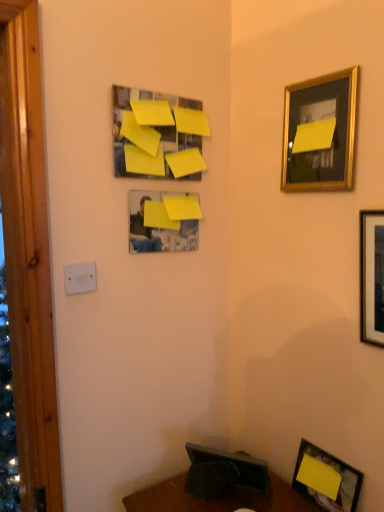
This screenshot has width=384, height=512. Find the location of `white plastic/light switch at lower left`. white plastic/light switch at lower left is located at coordinates (80, 278).

Image resolution: width=384 pixels, height=512 pixels. What do you see at coordinates (320, 133) in the screenshot? I see `gold metallic picture frame at upper right, which is counted as the third picture frame, starting from the left` at bounding box center [320, 133].

This screenshot has width=384, height=512. What do you see at coordinates (157, 135) in the screenshot? I see `yellow paper at upper center, positioned as the first picture frame in top-to-bottom order` at bounding box center [157, 135].

At what (x,y) coordinates should I click in order to perform the action: click on white plastic/light switch at lower left. Please return your answer as a coordinate pair (x, y). The height and width of the screenshot is (512, 384). Looking at the image, I should click on (80, 278).

Is yellow paper at upper center, which is the 5th picture frame from right to left, at the right side of wooden framed picture at right, arranged as the fourth picture frame when viewed from the top?

No.

Does point (130, 147) come in front of point (377, 327)?

That is False.

Is yellow paper at upper center, which ranks as the fifth picture frame in bottom-to-top order, aimed at wooden framed picture at right, arranged as the fourth picture frame when viewed from the top?

No, yellow paper at upper center, which ranks as the fifth picture frame in bottom-to-top order, is not aimed at wooden framed picture at right, arranged as the fourth picture frame when viewed from the top.

Is yellow paper at upper center, the 1th picture frame viewed from the left, next to wooden framed picture at right, which is the 1th picture frame in right-to-left order?

No.

From a real-world perspective, is gold metallic picture frame at upper right, arranged as the third picture frame when viewed from the right, positioned above or below white plastic/light switch at lower left?

Clearly, from a real-world perspective, gold metallic picture frame at upper right, arranged as the third picture frame when viewed from the right, is above white plastic/light switch at lower left.

Can we say gold metallic picture frame at upper right, which is counted as the third picture frame, starting from the left, lies outside white plastic/light switch at lower left?

Yes, gold metallic picture frame at upper right, which is counted as the third picture frame, starting from the left, is located beyond the bounds of white plastic/light switch at lower left.

Between gold metallic picture frame at upper right, the 4th picture frame from the bottom, and white plastic/light switch at lower left, which one appears on the right side from the viewer's perspective?

Positioned to the right is gold metallic picture frame at upper right, the 4th picture frame from the bottom.

Who is shorter, gold metallic picture frame at upper right, which is counted as the third picture frame, starting from the left, or white plastic/light switch at lower left?

white plastic/light switch at lower left is shorter.

Image resolution: width=384 pixels, height=512 pixels. In order to click on the 1st picture frame below the yellow matte picture frame at upper center, which is the 4th picture frame from right to left (from the image's perspective) in this screenshot , I will do `click(372, 277)`.

Is yellow matte picture frame at upper center, which is the 4th picture frame from right to left, far away from wooden framed picture at right, which is the 1th picture frame in right-to-left order?

yellow matte picture frame at upper center, which is the 4th picture frame from right to left, is near wooden framed picture at right, which is the 1th picture frame in right-to-left order, not far away.

Is yellow matte picture frame at upper center, which ranks as the 3th picture frame in bottom-to-top order, turned away from wooden framed picture at right, which is the 1th picture frame in right-to-left order?

yellow matte picture frame at upper center, which ranks as the 3th picture frame in bottom-to-top order, is not turned away from wooden framed picture at right, which is the 1th picture frame in right-to-left order.

Is yellow matte paper at lower right, which is the 1th picture frame from bottom to top, positioned behind gold metallic picture frame at upper right, which is counted as the third picture frame, starting from the left?

Yes, yellow matte paper at lower right, which is the 1th picture frame from bottom to top, is further from the camera.

Does yellow matte paper at lower right, the 2th picture frame when ordered from right to left, turn towards gold metallic picture frame at upper right, positioned as the 2th picture frame in top-to-bottom order?

No, yellow matte paper at lower right, the 2th picture frame when ordered from right to left, does not turn towards gold metallic picture frame at upper right, positioned as the 2th picture frame in top-to-bottom order.

From a real-world perspective, relative to gold metallic picture frame at upper right, the 4th picture frame from the bottom, is yellow matte paper at lower right, the 4th picture frame viewed from the left, vertically above or below?

From a real-world perspective, yellow matte paper at lower right, the 4th picture frame viewed from the left, is physically below gold metallic picture frame at upper right, the 4th picture frame from the bottom.

Is yellow matte paper at lower right, the 2th picture frame when ordered from right to left, not close to gold metallic picture frame at upper right, which is counted as the third picture frame, starting from the left?

No, yellow matte paper at lower right, the 2th picture frame when ordered from right to left, is not far from gold metallic picture frame at upper right, which is counted as the third picture frame, starting from the left.

Considering the relative sizes of white plastic/light switch at lower left and yellow matte paper at lower right, the 4th picture frame viewed from the left, in the image provided, is white plastic/light switch at lower left smaller than yellow matte paper at lower right, the 4th picture frame viewed from the left,?

Correct, white plastic/light switch at lower left occupies less space than yellow matte paper at lower right, the 4th picture frame viewed from the left.

Is yellow matte paper at lower right, the fifth picture frame viewed from the top, completely or partially inside white plastic/light switch at lower left?

No, yellow matte paper at lower right, the fifth picture frame viewed from the top, is not a part of white plastic/light switch at lower left.

Is white plastic/light switch at lower left to the left or to the right of yellow matte paper at lower right, the fifth picture frame viewed from the top, in the image?

white plastic/light switch at lower left is to the left of yellow matte paper at lower right, the fifth picture frame viewed from the top.

From the picture: What's the angular difference between white plastic/light switch at lower left and yellow matte paper at lower right, the 2th picture frame when ordered from right to left,'s facing directions?

86.8 degrees separate the facing orientations of white plastic/light switch at lower left and yellow matte paper at lower right, the 2th picture frame when ordered from right to left.

From a real-world perspective, is wooden framed picture at right, arranged as the fourth picture frame when viewed from the top, physically below gold metallic picture frame at upper right, which is counted as the third picture frame, starting from the left?

Yes.

Is point (379, 269) behind point (344, 95)?

That is False.

Which of these two, wooden framed picture at right, which appears as the 2th picture frame when ordered from the bottom, or gold metallic picture frame at upper right, arranged as the third picture frame when viewed from the right, is wider?

Wider between the two is gold metallic picture frame at upper right, arranged as the third picture frame when viewed from the right.

Where is `the 2nd picture frame to the right of the gold metallic picture frame at upper right, positioned as the 2th picture frame in top-to-bottom order, starting your count from the anchor`? the 2nd picture frame to the right of the gold metallic picture frame at upper right, positioned as the 2th picture frame in top-to-bottom order, starting your count from the anchor is located at coordinates (372, 277).

At what (x,y) coordinates should I click in order to perform the action: click on the 1st picture frame directly above the yellow matte paper at lower right, the fifth picture frame viewed from the top (from a real-world perspective). Please return your answer as a coordinate pair (x, y). Image resolution: width=384 pixels, height=512 pixels. Looking at the image, I should click on (372, 277).

Is the surface of yellow matte paper at lower right, the fifth picture frame viewed from the top, in direct contact with wooden framed picture at right, which appears as the 2th picture frame when ordered from the bottom?

No, yellow matte paper at lower right, the fifth picture frame viewed from the top, is not with wooden framed picture at right, which appears as the 2th picture frame when ordered from the bottom.

Considering the relative sizes of yellow matte paper at lower right, the 2th picture frame when ordered from right to left, and wooden framed picture at right, which is the 1th picture frame in right-to-left order, in the image provided, is yellow matte paper at lower right, the 2th picture frame when ordered from right to left, smaller than wooden framed picture at right, which is the 1th picture frame in right-to-left order,?

Yes.

From a real-world perspective, count 3rd picture frames downward from the yellow paper at upper center, which ranks as the fifth picture frame in bottom-to-top order, and point to it. Please provide its 2D coordinates.

[(372, 277)]

Which picture frame is the 2nd one when counting from the front of the white plastic/light switch at lower left? Please provide its 2D coordinates.

[(320, 133)]

Considering their positions, is gold metallic picture frame at upper right, arranged as the third picture frame when viewed from the right, positioned closer to yellow matte picture frame at upper center, which is the 4th picture frame from right to left, than white plastic/light switch at lower left?

Among the two, white plastic/light switch at lower left is located nearer to yellow matte picture frame at upper center, which is the 4th picture frame from right to left.

Which object lies nearer to the anchor point yellow matte picture frame at upper center, which is the 4th picture frame from right to left, yellow matte paper at lower right, the fifth picture frame viewed from the top, or wooden framed picture at right, which is the 1th picture frame in right-to-left order?

The object closer to yellow matte picture frame at upper center, which is the 4th picture frame from right to left, is wooden framed picture at right, which is the 1th picture frame in right-to-left order.

Looking at the image, which one is located closer to gold metallic picture frame at upper right, the 4th picture frame from the bottom, yellow matte paper at lower right, the fifth picture frame viewed from the top, or white plastic/light switch at lower left?

Based on the image, white plastic/light switch at lower left appears to be nearer to gold metallic picture frame at upper right, the 4th picture frame from the bottom.

Looking at the image, which one is located further to wooden framed picture at right, which is the 1th picture frame in right-to-left order, white plastic/light switch at lower left or gold metallic picture frame at upper right, arranged as the third picture frame when viewed from the right?

The object further to wooden framed picture at right, which is the 1th picture frame in right-to-left order, is white plastic/light switch at lower left.

When comparing their distances from yellow matte picture frame at upper center, which ranks as the 3th picture frame in bottom-to-top order, does yellow matte paper at lower right, the 2th picture frame when ordered from right to left, or white plastic/light switch at lower left seem further?

Based on the image, yellow matte paper at lower right, the 2th picture frame when ordered from right to left, appears to be further to yellow matte picture frame at upper center, which ranks as the 3th picture frame in bottom-to-top order.

Considering their positions, is gold metallic picture frame at upper right, which is counted as the third picture frame, starting from the left, positioned closer to wooden framed picture at right, which appears as the 2th picture frame when ordered from the bottom, than white plastic/light switch at lower left?

gold metallic picture frame at upper right, which is counted as the third picture frame, starting from the left, is positioned closer to the anchor wooden framed picture at right, which appears as the 2th picture frame when ordered from the bottom.

Consider the image. Based on their spatial positions, is gold metallic picture frame at upper right, the 4th picture frame from the bottom, or yellow matte paper at lower right, the fifth picture frame viewed from the top, further from wooden framed picture at right, arranged as the fourth picture frame when viewed from the top?

yellow matte paper at lower right, the fifth picture frame viewed from the top, lies further to wooden framed picture at right, arranged as the fourth picture frame when viewed from the top, than the other object.

When comparing their distances from gold metallic picture frame at upper right, arranged as the third picture frame when viewed from the right, does yellow matte picture frame at upper center, the 3th picture frame positioned from the top, or yellow matte paper at lower right, the fifth picture frame viewed from the top, seem further?

The object further to gold metallic picture frame at upper right, arranged as the third picture frame when viewed from the right, is yellow matte paper at lower right, the fifth picture frame viewed from the top.

This screenshot has width=384, height=512. Identify the location of picture frame between yellow paper at upper center, positioned as the first picture frame in top-to-bottom order, and gold metallic picture frame at upper right, which is counted as the third picture frame, starting from the left. (162, 222).

Where is `light switch between gold metallic picture frame at upper right, positioned as the 2th picture frame in top-to-bottom order, and yellow matte paper at lower right, the 4th picture frame viewed from the left, in the up-down direction`? This screenshot has height=512, width=384. light switch between gold metallic picture frame at upper right, positioned as the 2th picture frame in top-to-bottom order, and yellow matte paper at lower right, the 4th picture frame viewed from the left, in the up-down direction is located at coordinates (80, 278).

The width and height of the screenshot is (384, 512). Find the location of `light switch between yellow paper at upper center, positioned as the first picture frame in top-to-bottom order, and yellow matte paper at lower right, the 4th picture frame viewed from the left, from top to bottom`. light switch between yellow paper at upper center, positioned as the first picture frame in top-to-bottom order, and yellow matte paper at lower right, the 4th picture frame viewed from the left, from top to bottom is located at coordinates (80, 278).

I want to click on picture frame between yellow matte picture frame at upper center, which ranks as the 3th picture frame in bottom-to-top order, and yellow matte paper at lower right, which is the 1th picture frame from bottom to top, in the up-down direction, so click(372, 277).